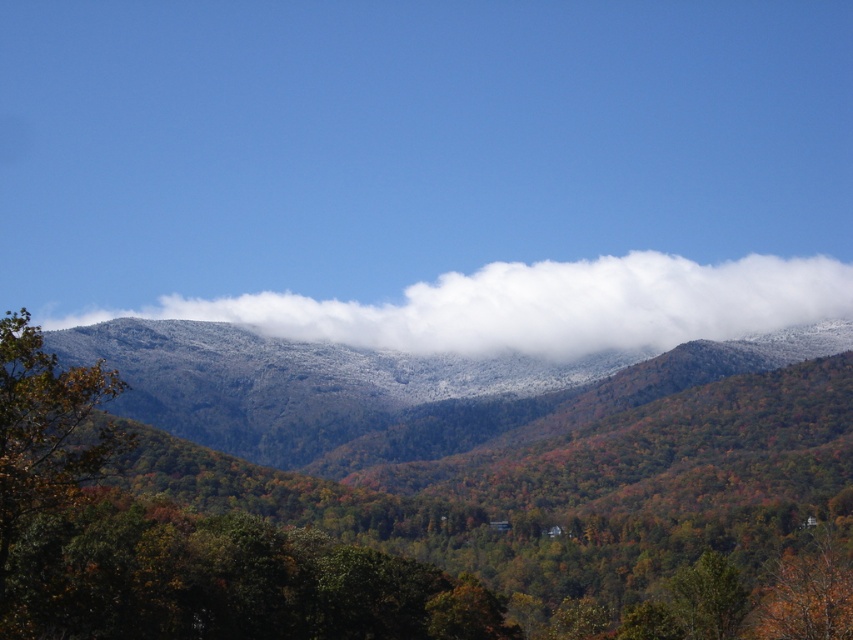
Question: Which point is closer to the camera?

Choices:
 (A) green matte forest at center
 (B) white fluffy cloud at upper center

Answer: (A)

Question: Among these points, which one is farthest from the camera?

Choices:
 (A) (221, 312)
 (B) (471, 563)

Answer: (A)

Question: Can you confirm if green matte forest at center is smaller than white fluffy cloud at upper center?

Choices:
 (A) yes
 (B) no

Answer: (B)

Question: Can you confirm if green matte forest at center is positioned above white fluffy cloud at upper center?

Choices:
 (A) yes
 (B) no

Answer: (B)

Question: Can you confirm if green matte forest at center is bigger than white fluffy cloud at upper center?

Choices:
 (A) no
 (B) yes

Answer: (B)